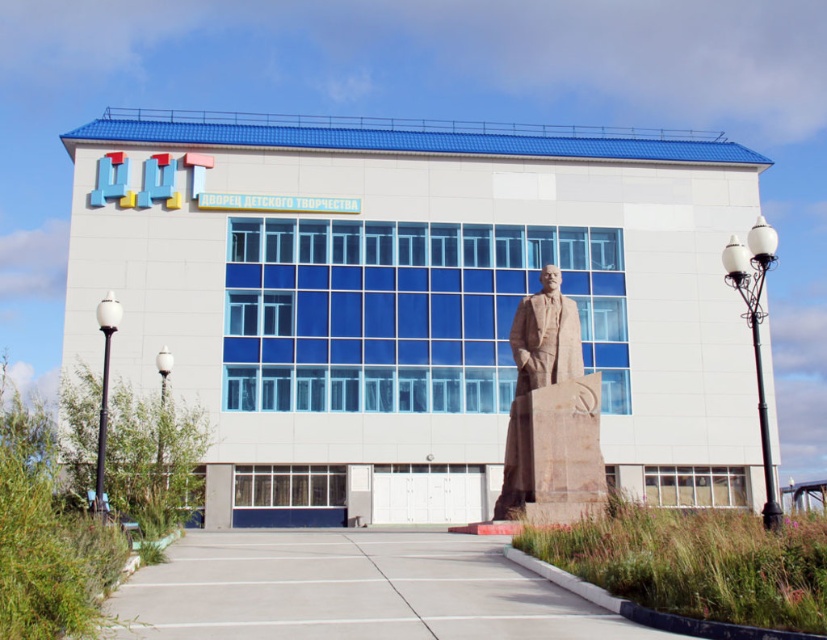
Consider the image. What is the relationship in size between the polished stone statue at center and the white glass lamp post at left in the image?

The polished stone statue at center is larger in size than the white glass lamp post at left.

You are standing in front of the modern building and want to locate the brown stone statue at center. Can you tell me where exactly the point at coordinates (541,385) is located on the statue?

The point at coordinates (541,385) is located on the brown stone statue at center, so it is part of the statue itself.

You are an architect reviewing the building plans. The polished stone statue at center and the white glass lamp post at left are both part of the design. If the statue is wider than the lamp post, how does this affect their placement in the facade layout?

The polished stone statue at center is wider than the white glass lamp post at left, so it requires more space in the facade layout to accommodate its greater width.